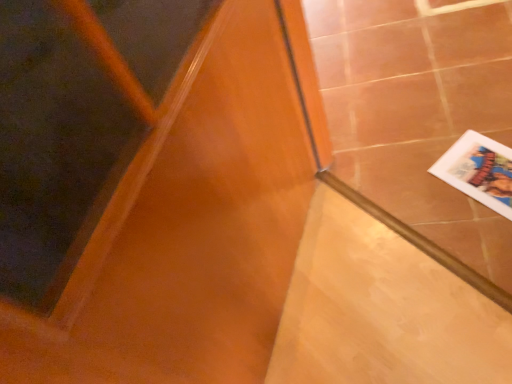
This screenshot has width=512, height=384. What do you see at coordinates (479, 171) in the screenshot? I see `white paper book at lower right` at bounding box center [479, 171].

Identify the location of white paper book at lower right. This screenshot has height=384, width=512. coord(479,171).

At what (x,y) coordinates should I click in order to perform the action: click on white paper book at lower right. Please return your answer as a coordinate pair (x, y). Looking at the image, I should click on (479, 171).